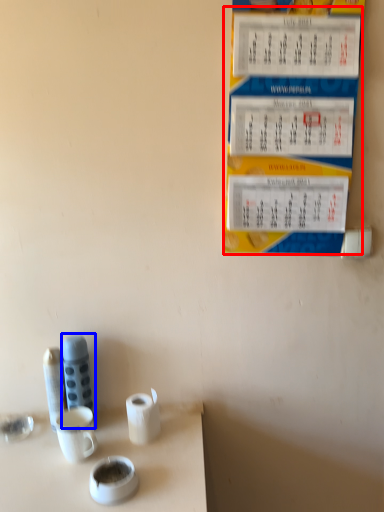
Question: Among these objects, which one is farthest to the camera, menu (highlighted by a red box) or stationery (highlighted by a blue box)?

Choices:
 (A) menu
 (B) stationery

Answer: (B)